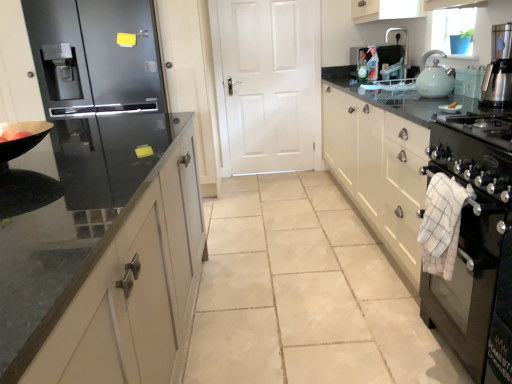
Question: Is silver metallic faucet at upper right bigger or smaller than black glossy countertop at right?

Choices:
 (A) big
 (B) small

Answer: (B)

Question: Relative to black glossy countertop at right, is silver metallic faucet at upper right in front or behind?

Choices:
 (A) behind
 (B) front

Answer: (A)

Question: Which object is the closest to the light blue ceramic kettle at upper right, the 2th kitchen appliance in the front-to-back sequence?

Choices:
 (A) glossy black refrigerator at left
 (B) satin silver coffee maker at upper right, which appears as the first kitchen appliance when viewed from the front
 (C) black glossy countertop at right
 (D) white checkered towel at right
 (E) silver metallic faucet at upper right

Answer: (B)

Question: Estimate the real-world distances between objects in this image. Which object is farther from the white matte door at center?

Choices:
 (A) silver metallic faucet at upper right
 (B) black glossy countertop at right
 (C) black glass stove at right
 (D) satin silver coffee maker at upper right, which appears as the first kitchen appliance when viewed from the front
 (E) matte orange tomato at left

Answer: (C)